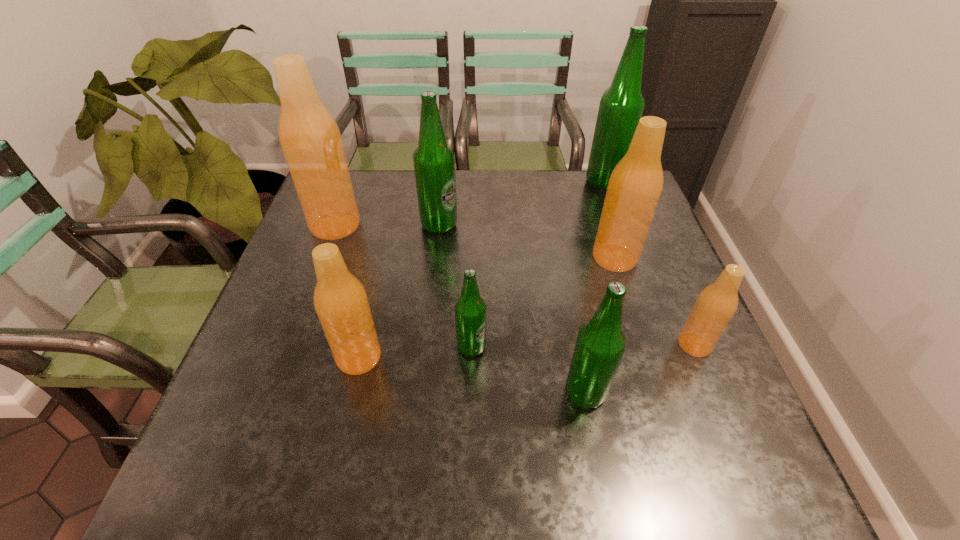
Identify the location of vacant space that's between the fourth object from left to right and the second biggest green beer bottle. This screenshot has height=540, width=960. (455, 286).

You are a GUI agent. You are given a task and a screenshot of the screen. Output one action in this format:
    pyautogui.click(x=<x>, y=<y>)
    Task: Click on the free point between the third nearest green beer bottle and the farthest tan beer bottle
    This screenshot has width=960, height=540.
    Given the screenshot: What is the action you would take?
    pyautogui.click(x=387, y=225)

I want to click on object that ranks as the seventh closest to the third farthest green beer bottle, so click(x=621, y=106).

In order to click on the fifth closest object to the sixth beer bottle from right to left in this screenshot , I will do `click(621, 106)`.

Identify which beer bottle is the seventh closest to the rightmost tan beer bottle. Please provide its 2D coordinates. Your answer should be formatted as a tuple, i.e. [(x, y)], where the tuple contains the x and y coordinates of a point satisfying the conditions above.

[(309, 136)]

I want to click on the fifth closest beer bottle to the second smallest tan beer bottle, so click(x=635, y=185).

I want to click on green beer bottle that is the third closest one to the fifth object from left to right, so 621,106.

Identify the location of green beer bottle that is the closest to the third smallest tan beer bottle. (621, 106).

I want to click on the second closest tan beer bottle relative to the farthest tan beer bottle, so click(635, 185).

Locate which tan beer bottle is the closest to the farthest green beer bottle. Please provide its 2D coordinates. Your answer should be formatted as a tuple, i.e. [(x, y)], where the tuple contains the x and y coordinates of a point satisfying the conditions above.

[(635, 185)]